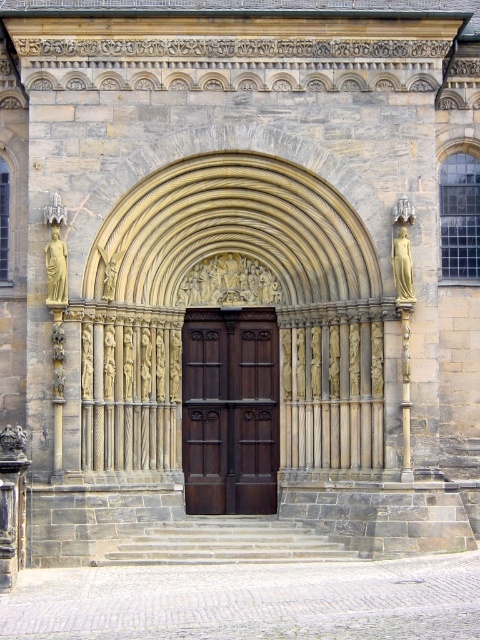
You are standing at the entrance of the historic building and want to locate the golden stone statue at left. According to the coordinates provided, where should you look relative to the main doorway?

The golden stone statue at left is located at coordinates point [56,268], which means it is positioned to the left side and slightly below the center of the entrance area relative to the main doorway.

You are an architect measuring the spacing between the stone relief figures at center and the golden stone statue at left for a restoration project. Given that the minimum required distance for safe restoration work is 10 meters, can the current distance accommodate the restoration team?

The distance between the stone relief figures at center and the golden stone statue at left is 11.45 meters, which exceeds the minimum required 10 meters. Therefore, the current distance can accommodate the restoration team safely.